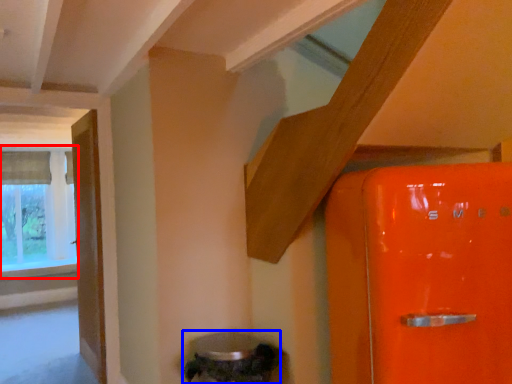
Question: Which object is further to the camera taking this photo, window (highlighted by a red box) or water heater (highlighted by a blue box)?

Choices:
 (A) window
 (B) water heater

Answer: (A)